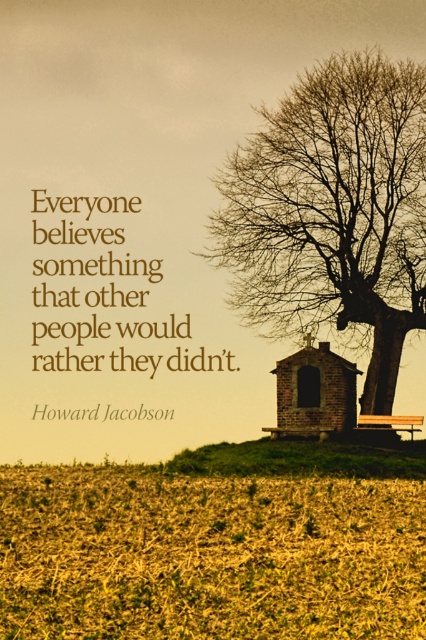
Question: Among these objects, which one is farthest from the camera?

Choices:
 (A) brick chapel at center
 (B) bare wood tree at upper right
 (C) wooden park bench at lower right
 (D) brown paper text at upper center

Answer: (B)

Question: Is bare wood tree at upper right closer to camera compared to green grassy hill at lower center?

Choices:
 (A) no
 (B) yes

Answer: (A)

Question: Which point appears farthest from the camera in this image?

Choices:
 (A) (379, 422)
 (B) (89, 260)
 (C) (331, 176)
 (D) (264, 449)

Answer: (C)

Question: Is brown paper text at upper center in front of brick chapel at center?

Choices:
 (A) yes
 (B) no

Answer: (A)

Question: Can you confirm if brown paper text at upper center is wider than green grassy hill at lower center?

Choices:
 (A) no
 (B) yes

Answer: (A)

Question: Estimate the real-world distances between objects in this image. Which object is closer to the brown paper text at upper center?

Choices:
 (A) bare wood tree at upper right
 (B) brick chapel at center

Answer: (B)